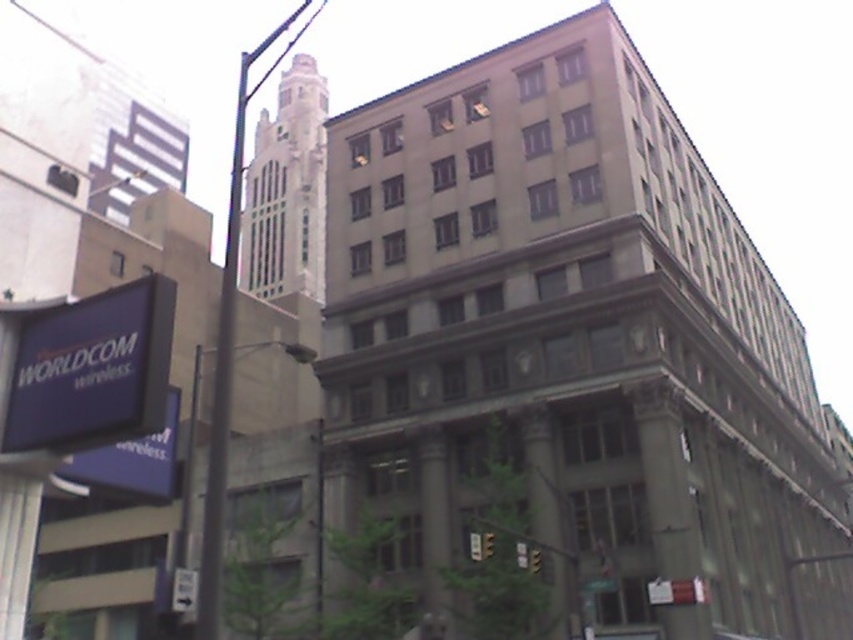
Question: Observing the image, what is the correct spatial positioning of blue plastic sign at lower left in reference to metallic pole at left?

Choices:
 (A) left
 (B) right

Answer: (B)

Question: Is blue plastic sign at lower left to the left of metallic pole at left from the viewer's perspective?

Choices:
 (A) yes
 (B) no

Answer: (B)

Question: Is blue plastic sign at lower left wider than metallic pole at left?

Choices:
 (A) yes
 (B) no

Answer: (B)

Question: Among these objects, which one is farthest from the camera?

Choices:
 (A) metallic pole at left
 (B) blue plastic sign at lower left

Answer: (A)

Question: Among these objects, which one is nearest to the camera?

Choices:
 (A) metallic pole at left
 (B) blue plastic sign at lower left

Answer: (B)